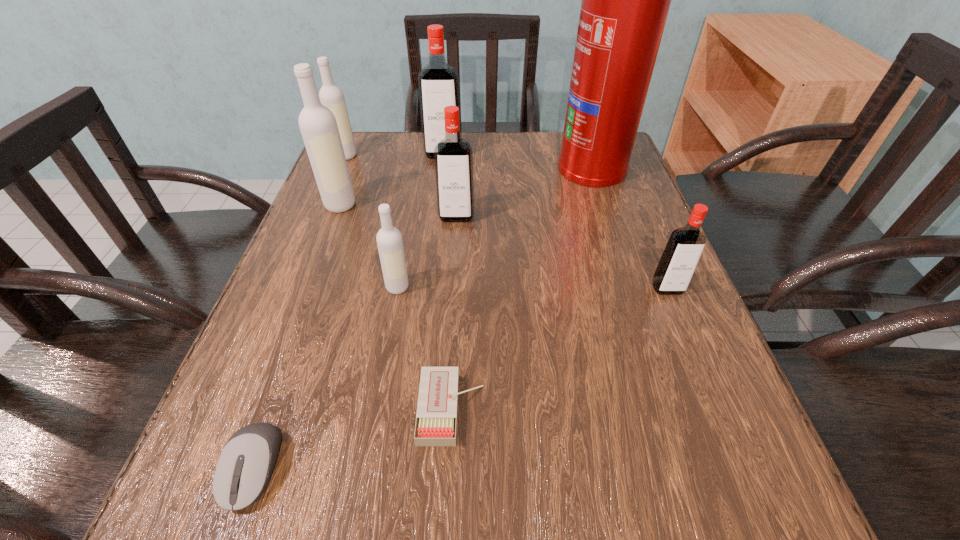
Image resolution: width=960 pixels, height=540 pixels. Find the location of `object that is at the far right corner`. object that is at the far right corner is located at coordinates point(625,2).

In the image, there is a desktop. Find the location of `vacant space at the far edge`. vacant space at the far edge is located at coordinates (512, 136).

Locate an element on the screen. This screenshot has width=960, height=540. free space at the near edge of the desktop is located at coordinates (412, 528).

Where is `vacant space at the left edge of the desktop`? vacant space at the left edge of the desktop is located at coordinates (316, 258).

In the image, there is a desktop. Where is `blank space at the right edge`? The height and width of the screenshot is (540, 960). blank space at the right edge is located at coordinates (719, 438).

The image size is (960, 540). I want to click on vacant space at the far left corner, so click(x=392, y=139).

Where is `free spot at the near left corner of the desktop`? This screenshot has width=960, height=540. free spot at the near left corner of the desktop is located at coordinates (302, 523).

This screenshot has height=540, width=960. I want to click on unoccupied position between the smallest white vodka and the tallest object, so click(x=494, y=226).

Identify the location of empty space between the tallest object and the second nearest red vodka. Image resolution: width=960 pixels, height=540 pixels. (524, 191).

The width and height of the screenshot is (960, 540). I want to click on free point between the computer equipment and the red fire extinguisher, so click(422, 317).